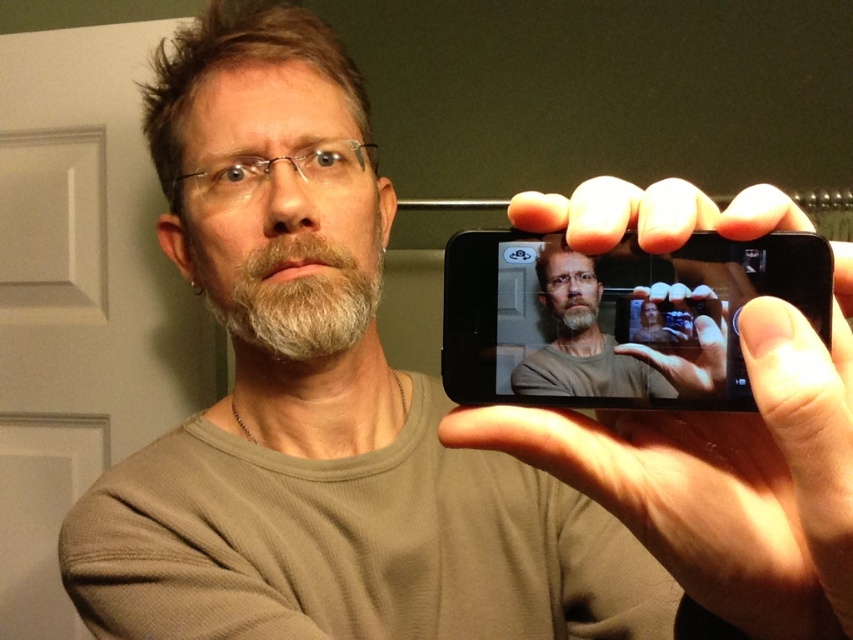
Question: Which of the following is the farthest from the observer?

Choices:
 (A) black matte smartphone at center
 (B) smooth skin hand at upper right
 (C) matte black phone at center

Answer: (C)

Question: Does black matte smartphone at center have a greater width compared to matte black phone at center?

Choices:
 (A) no
 (B) yes

Answer: (B)

Question: Does black matte smartphone at center appear under matte black phone at center?

Choices:
 (A) no
 (B) yes

Answer: (A)

Question: Considering the relative positions of smooth skin hand at upper right and matte black phone at center in the image provided, where is smooth skin hand at upper right located with respect to matte black phone at center?

Choices:
 (A) below
 (B) above

Answer: (A)

Question: Which object is closer to the camera taking this photo?

Choices:
 (A) matte black phone at center
 (B) black matte smartphone at center
 (C) smooth skin hand at upper right

Answer: (C)

Question: Considering the real-world distances, which object is farthest from the black matte smartphone at center?

Choices:
 (A) smooth skin hand at upper right
 (B) matte black phone at center

Answer: (A)